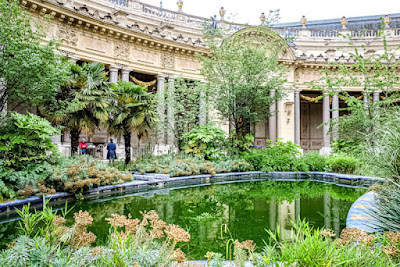
I want to click on column, so click(x=326, y=104).